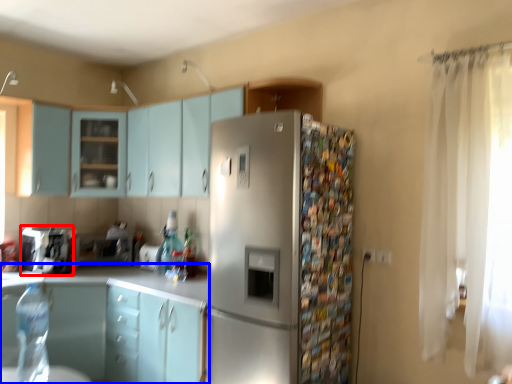
Question: Which object appears farthest to the camera in this image, appliance (highlighted by a red box) or cabinetry (highlighted by a blue box)?

Choices:
 (A) appliance
 (B) cabinetry

Answer: (A)